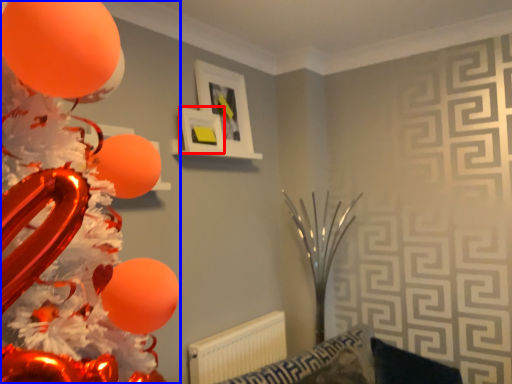
Question: Among these objects, which one is nearest to the camera, picture frame (highlighted by a red box) or balloon (highlighted by a blue box)?

Choices:
 (A) picture frame
 (B) balloon

Answer: (B)